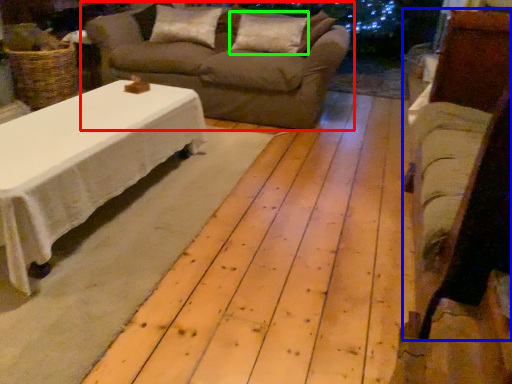
Question: Considering the real-world distances, which object is farthest from studio couch (highlighted by a red box)? armchair (highlighted by a blue box) or pillow (highlighted by a green box)?

Choices:
 (A) armchair
 (B) pillow

Answer: (A)